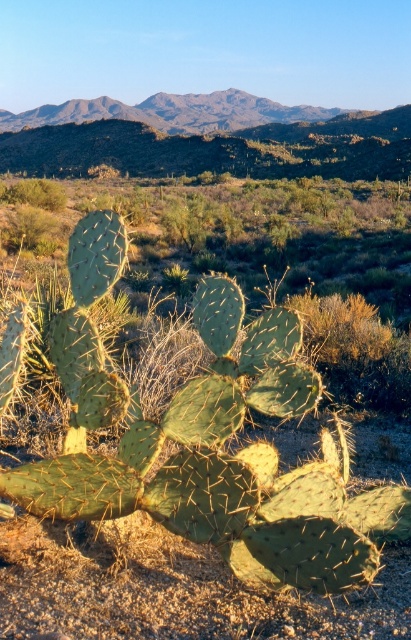
Which is in front, point (263, 406) or point (300, 120)?

Point (263, 406) is more forward.

Who is more forward, [85,234] or [18,122]?

Positioned in front is point [85,234].

Identify the location of green spiny cactus at center. pyautogui.click(x=205, y=440).